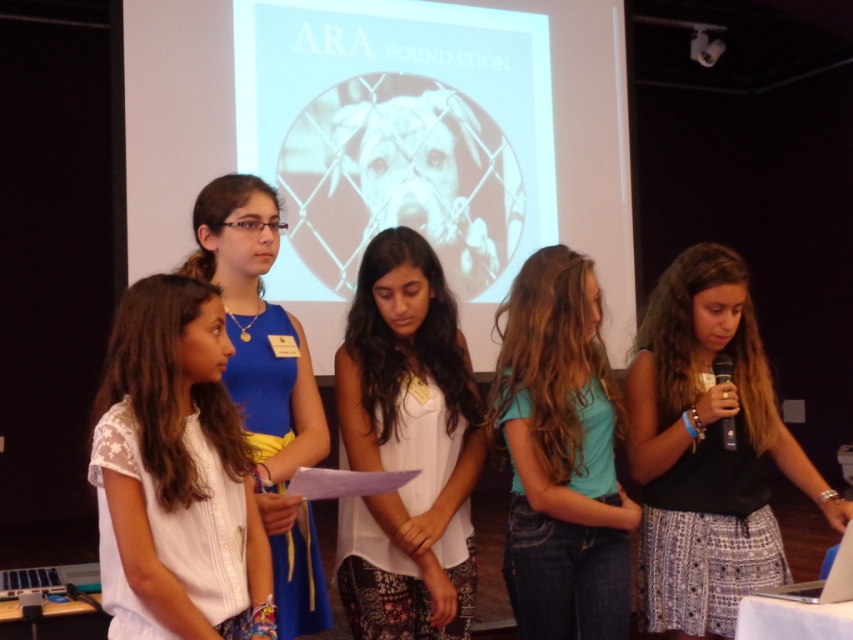
Between white lace blouse at center and white fabric shirt at left, which one has less height?

white lace blouse at center is shorter.

Is white lace blouse at center wider than white fabric shirt at left?

No, white lace blouse at center is not wider than white fabric shirt at left.

Where is `white lace blouse at center`? The width and height of the screenshot is (853, 640). white lace blouse at center is located at coordinates (175, 474).

Between white cotton shirt at center and white fabric shirt at left, which one has less height?

Standing shorter between the two is white cotton shirt at center.

Is the position of white cotton shirt at center less distant than that of white fabric shirt at left?

No, it is behind white fabric shirt at left.

Is point (404, 572) closer to viewer compared to point (241, 337)?

No, it is not.

Locate an element on the screen. This screenshot has height=640, width=853. white cotton shirt at center is located at coordinates (407, 448).

What do you see at coordinates (175, 474) in the screenshot?
I see `white lace blouse at center` at bounding box center [175, 474].

Does white lace blouse at center have a greater width compared to white cotton shirt at center?

Incorrect, white lace blouse at center's width does not surpass white cotton shirt at center's.

Describe the element at coordinates (175, 474) in the screenshot. The image size is (853, 640). I see `white lace blouse at center` at that location.

The width and height of the screenshot is (853, 640). Identify the location of white lace blouse at center. (175, 474).